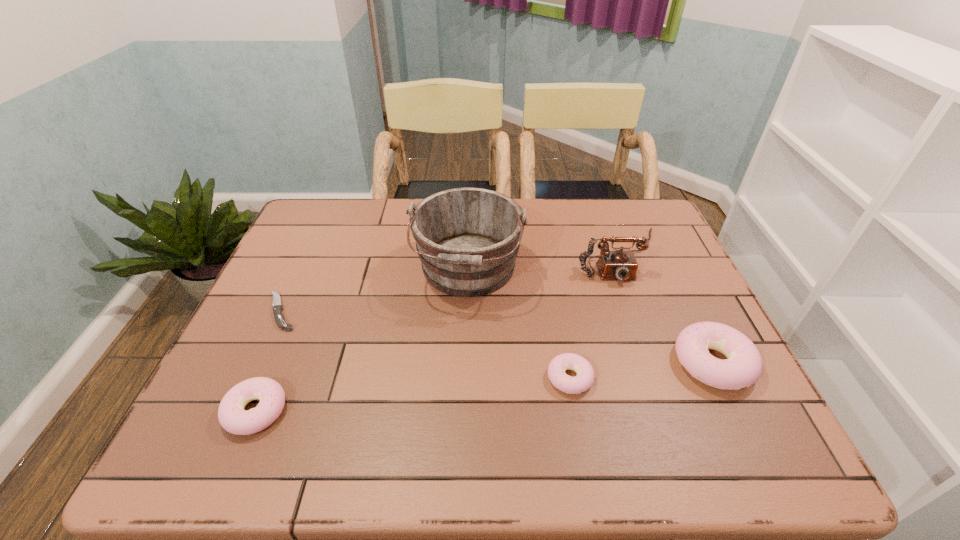
The image size is (960, 540). What are the coordinates of `vacant space that is in between the tallest object and the telephone` in the screenshot? It's located at (543, 262).

This screenshot has width=960, height=540. I want to click on free point between the third tallest object and the pocketknife, so click(x=497, y=337).

Image resolution: width=960 pixels, height=540 pixels. Find the location of `blank region between the shortest object and the tallest doughnut`. blank region between the shortest object and the tallest doughnut is located at coordinates (497, 337).

I want to click on free spot between the leftmost doughnut and the third object from right to left, so coord(413,394).

Image resolution: width=960 pixels, height=540 pixels. I want to click on free space between the rightmost doughnut and the tallest object, so click(590, 316).

Find the location of a particular element. The width and height of the screenshot is (960, 540). free space between the leftmost doughnut and the fifth shortest object is located at coordinates (438, 333).

Identify the location of vacant space in between the third object from left to right and the shortest object. The height and width of the screenshot is (540, 960). [x=375, y=290].

In order to click on vacant area that lies between the fifth shortest object and the third object from right to left in this screenshot , I will do `click(594, 317)`.

This screenshot has height=540, width=960. I want to click on the fourth closest object to the third object from left to right, so click(233, 418).

Point out which object is positioned as the fifth nearest to the fourth tallest object. Please provide its 2D coordinates. Your answer should be formatted as a tuple, i.e. [(x, y)], where the tuple contains the x and y coordinates of a point satisfying the conditions above.

[(742, 368)]